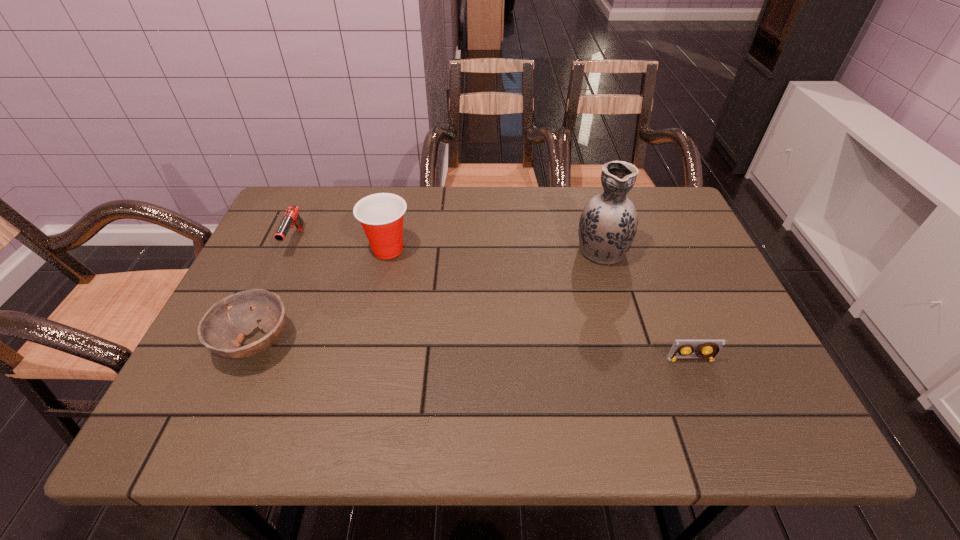
Image resolution: width=960 pixels, height=540 pixels. Identify the location of vacant space that's between the gun and the videotape. (492, 300).

Where is `empty space that is in between the second tallest object and the gun`? This screenshot has width=960, height=540. empty space that is in between the second tallest object and the gun is located at coordinates (342, 245).

This screenshot has width=960, height=540. I want to click on free space between the vase and the second tallest object, so click(x=494, y=249).

The height and width of the screenshot is (540, 960). In order to click on vacant space that's between the cup and the gun in this screenshot , I will do `click(342, 245)`.

At what (x,y) coordinates should I click in order to perform the action: click on free area in between the bowl and the videotape. Please return your answer as a coordinate pair (x, y). The image size is (960, 540). Looking at the image, I should click on (473, 351).

What are the coordinates of `empty location between the tallest object and the bowl` in the screenshot? It's located at (428, 295).

Select which object appears as the third closest to the cup. Please provide its 2D coordinates. Your answer should be formatted as a tuple, i.e. [(x, y)], where the tuple contains the x and y coordinates of a point satisfying the conditions above.

[(608, 223)]

I want to click on object that is the nearest to the bowl, so click(381, 215).

In order to click on free space that satisfies the following two spatial constraints: 1. at the aiming end of the third object from right to left; 2. on the right side of the gun in this screenshot , I will do `click(292, 249)`.

Where is `vacant position in the image that satisfies the following two spatial constraints: 1. at the aiming end of the gun; 2. on the right side of the bowl`? Image resolution: width=960 pixels, height=540 pixels. vacant position in the image that satisfies the following two spatial constraints: 1. at the aiming end of the gun; 2. on the right side of the bowl is located at coordinates (250, 342).